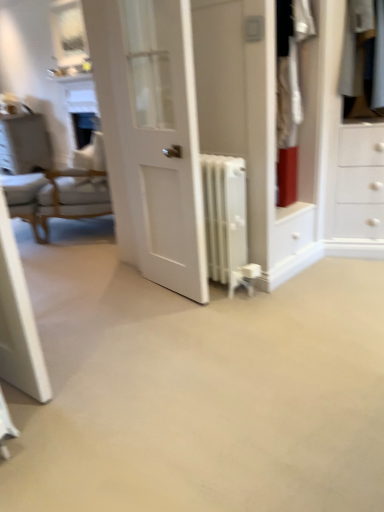
Find the location of `vacant space to the right of white metallic radiator at center`. vacant space to the right of white metallic radiator at center is located at coordinates (284, 293).